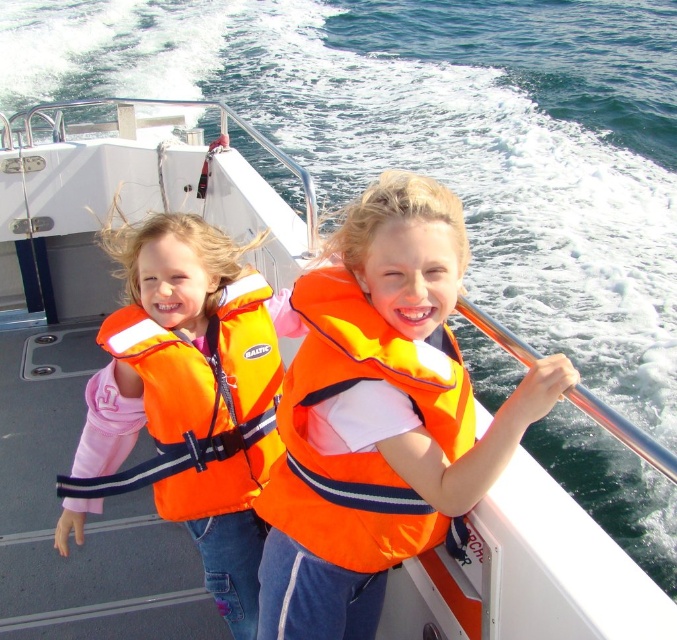
Is point (118, 241) closer to viewer compared to point (311, 468)?

No, (118, 241) is further to viewer.

Between point (192, 344) and point (447, 381), which one is positioned in front?

Point (447, 381)

Find the location of `orange life vest at left`. orange life vest at left is located at coordinates (196, 394).

Which of these two, orange life vest at center or orange life vest at left, stands taller?

orange life vest at left is taller.

Who is more forward, (395, 365) or (156, 404)?

Point (395, 365) is in front.

Describe the element at coordinates (378, 417) in the screenshot. I see `orange life vest at center` at that location.

At what (x,y) coordinates should I click in order to perform the action: click on orange life vest at center. Please return your answer as a coordinate pair (x, y). Looking at the image, I should click on (378, 417).

Which is behind, point (387, 346) or point (160, 468)?

Positioned behind is point (160, 468).

Is orange fabric life vest at center smaller than orange fabric life jacket at left?

Yes.

Is point (290, 300) farther from camera compared to point (156, 502)?

No, (290, 300) is in front of (156, 502).

Where is `orange fabric life vest at center`? orange fabric life vest at center is located at coordinates (359, 452).